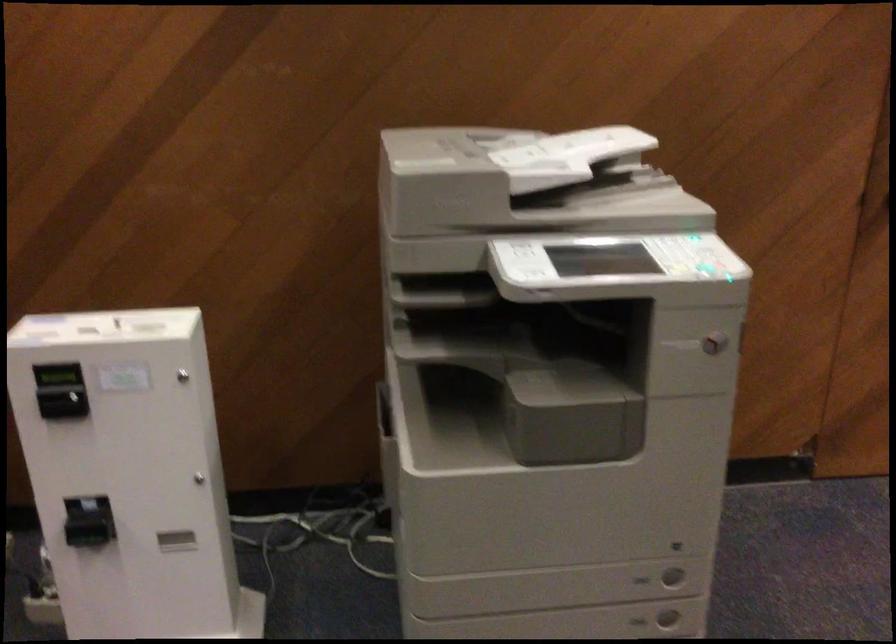
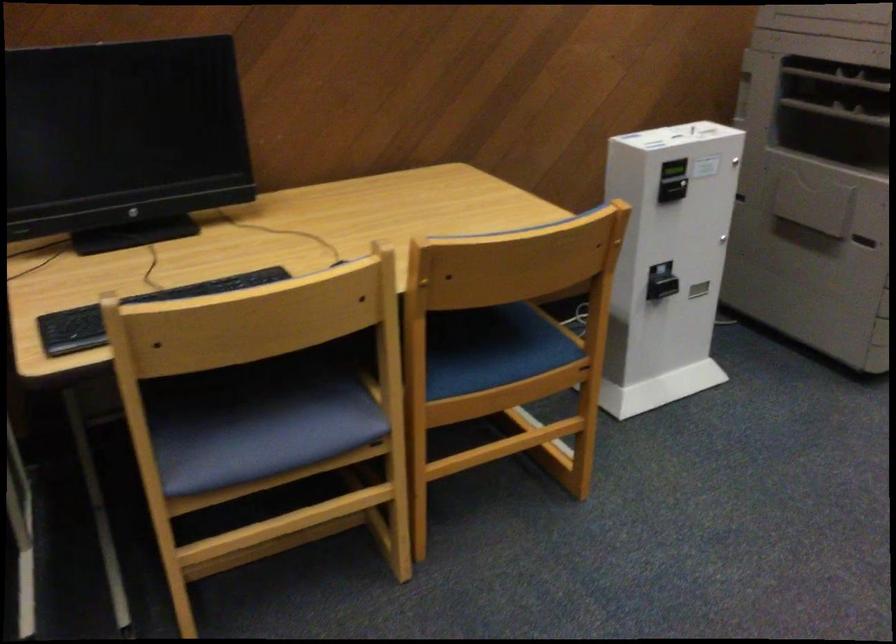
Locate, in the second image, the point that corresponds to point (388, 281) in the first image.

(839, 79)